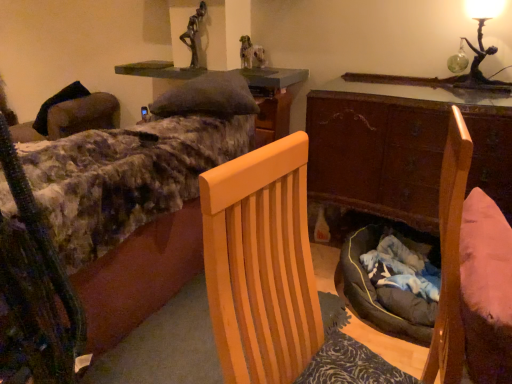
Question: Is fluffy fabric bed at upper left with wooden desk at center?

Choices:
 (A) no
 (B) yes

Answer: (A)

Question: From a real-world perspective, is fluffy fabric bed at upper left over wooden desk at center?

Choices:
 (A) no
 (B) yes

Answer: (A)

Question: Considering the relative sizes of fluffy fabric bed at upper left and wooden desk at center in the image provided, is fluffy fabric bed at upper left taller than wooden desk at center?

Choices:
 (A) yes
 (B) no

Answer: (A)

Question: Can you confirm if fluffy fabric bed at upper left is bigger than wooden desk at center?

Choices:
 (A) yes
 (B) no

Answer: (A)

Question: Considering the relative sizes of fluffy fabric bed at upper left and wooden desk at center in the image provided, is fluffy fabric bed at upper left wider than wooden desk at center?

Choices:
 (A) no
 (B) yes

Answer: (B)

Question: Could you tell me if fluffy fabric bed at upper left is turned towards wooden desk at center?

Choices:
 (A) yes
 (B) no

Answer: (B)

Question: Considering the relative positions of light wood chair at center and fluffy fabric bed at upper left in the image provided, is light wood chair at center to the left of fluffy fabric bed at upper left from the viewer's perspective?

Choices:
 (A) no
 (B) yes

Answer: (A)

Question: From the image's perspective, is light wood chair at center below fluffy fabric bed at upper left?

Choices:
 (A) yes
 (B) no

Answer: (A)

Question: Can you confirm if light wood chair at center is wider than fluffy fabric bed at upper left?

Choices:
 (A) no
 (B) yes

Answer: (A)

Question: Considering the relative sizes of light wood chair at center and fluffy fabric bed at upper left in the image provided, is light wood chair at center thinner than fluffy fabric bed at upper left?

Choices:
 (A) yes
 (B) no

Answer: (A)

Question: Is there a large distance between light wood chair at center and fluffy fabric bed at upper left?

Choices:
 (A) no
 (B) yes

Answer: (A)

Question: Does light wood chair at center appear on the right side of fluffy fabric bed at upper left?

Choices:
 (A) yes
 (B) no

Answer: (A)

Question: Is light wood chair at center positioned with its back to green felt cushion at upper center?

Choices:
 (A) yes
 (B) no

Answer: (B)